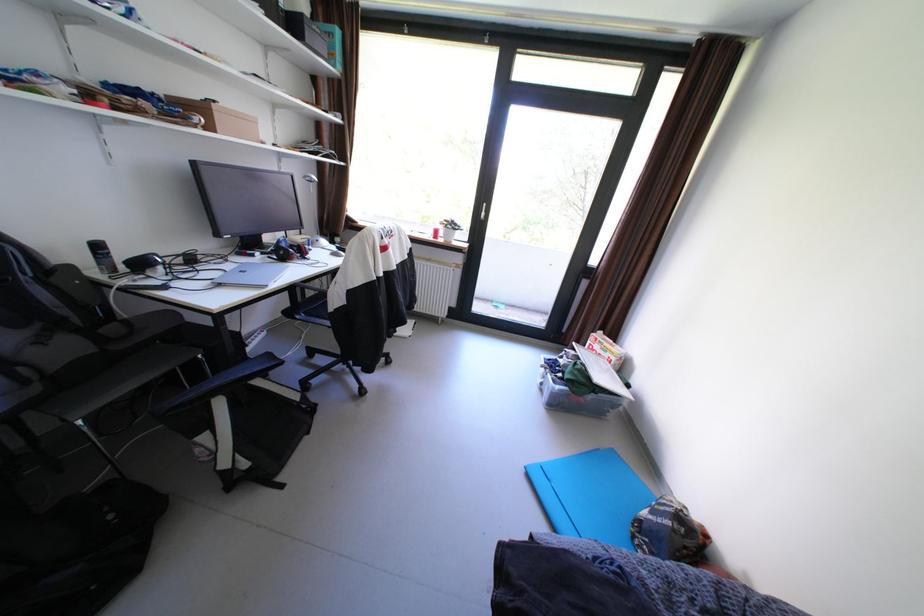
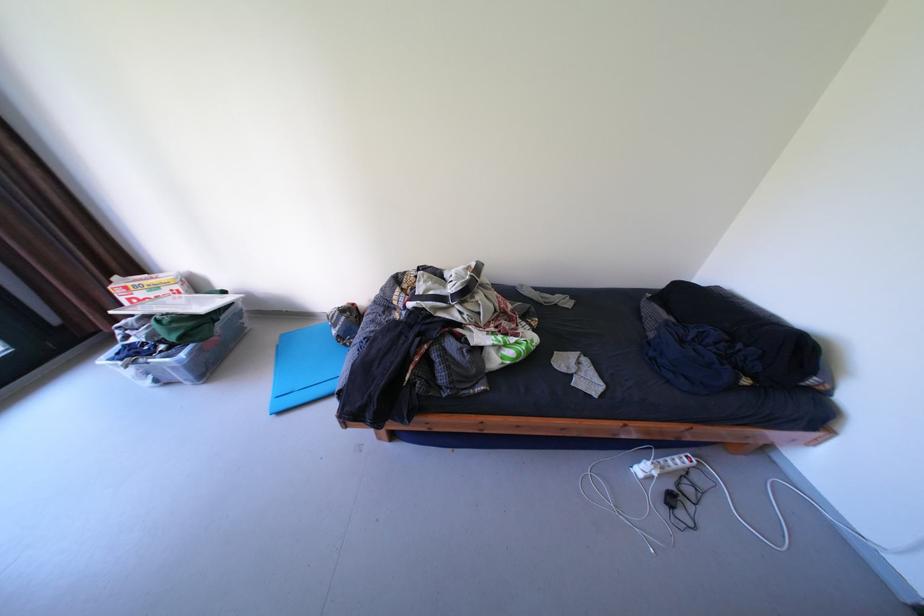
Based on the continuous images, in which direction is the camera rotating?

The rotation direction of the camera is right-down.